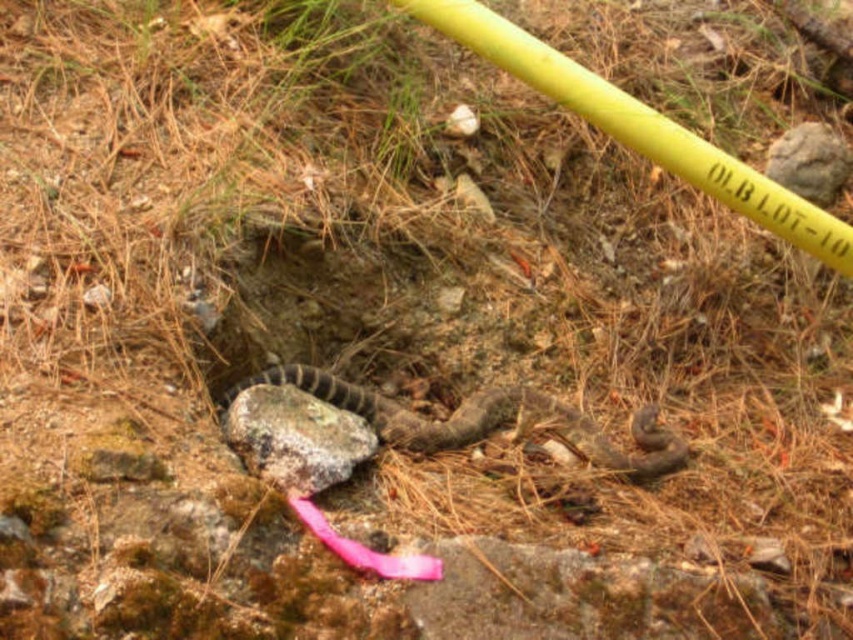
From the picture: Between gray rough rock at center and gray rough rock at upper right, which one has more height?

With more height is gray rough rock at upper right.

Does gray rough rock at center appear under gray rough rock at upper right?

Indeed, gray rough rock at center is positioned under gray rough rock at upper right.

Which is in front, point (346, 424) or point (815, 166)?

Point (346, 424)

The height and width of the screenshot is (640, 853). I want to click on gray rough rock at center, so click(294, 436).